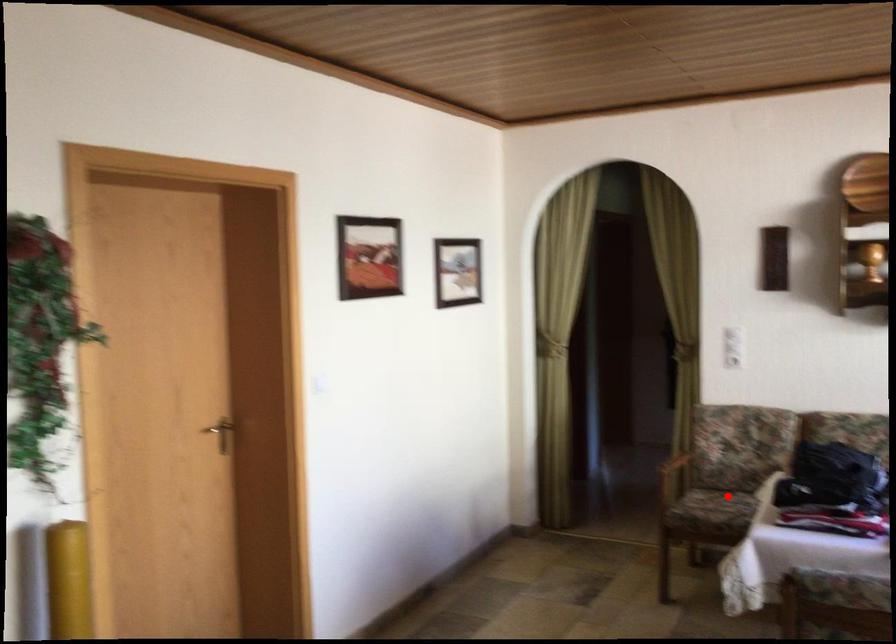
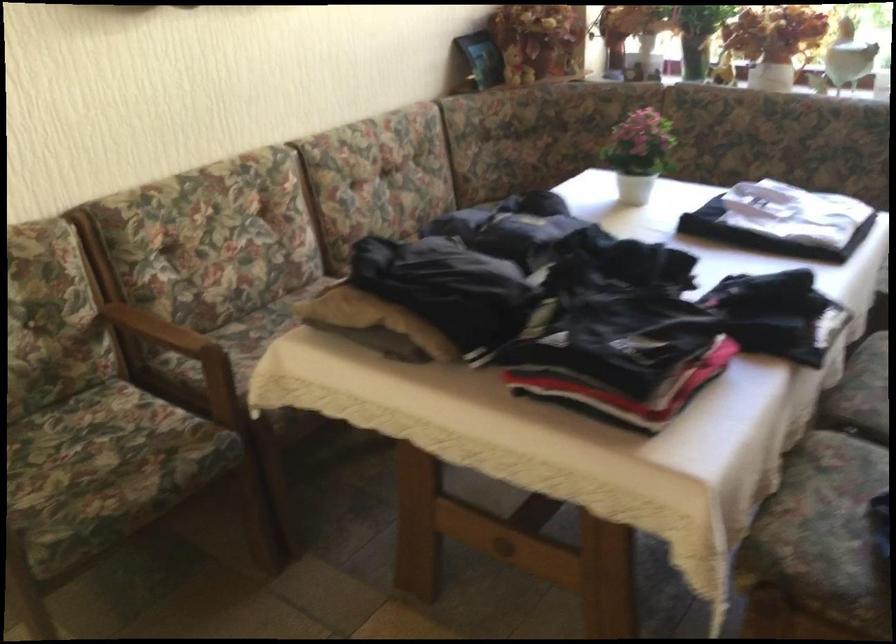
In the second image, find the point that corresponds to the highlighted location in the first image.

(67, 444)